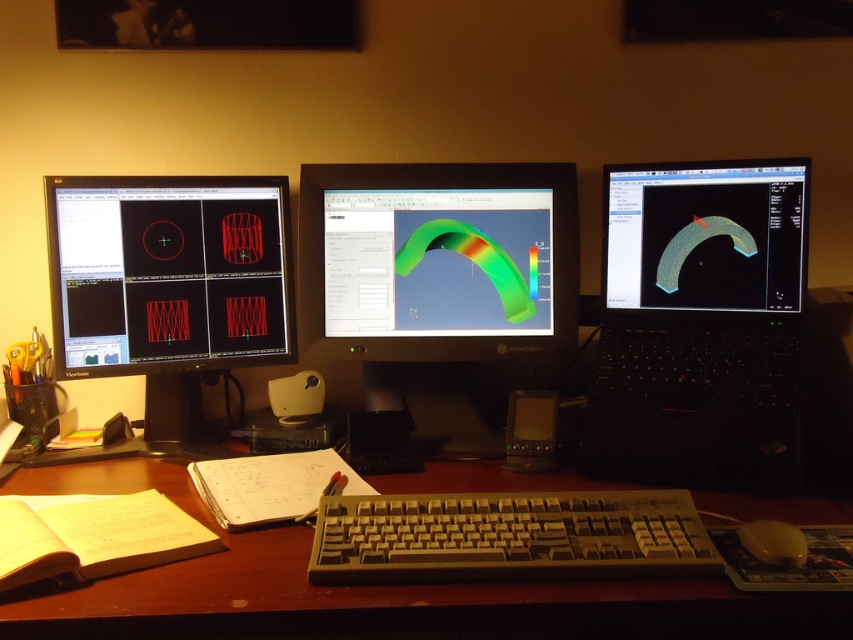
Question: Is green matte 3d model at center thinner than white plastic mouse at lower right?

Choices:
 (A) yes
 (B) no

Answer: (B)

Question: Estimate the real-world distances between objects in this image. Which object is closer to the green matte curved object at center?

Choices:
 (A) brown wood table at center
 (B) green matte monitor at center

Answer: (B)

Question: Can you confirm if black glossy laptop at right is thinner than green matte monitor at center?

Choices:
 (A) yes
 (B) no

Answer: (A)

Question: Considering the real-world distances, which object is closest to the beige plastic keyboard at center?

Choices:
 (A) green matte curved object at center
 (B) brown wood table at center
 (C) green matte 3d model at center

Answer: (B)

Question: Based on their relative distances, which object is nearer to the green matte monitor at center?

Choices:
 (A) black glossy laptop at right
 (B) matte black monitor at left
 (C) beige plastic keyboard at center

Answer: (B)

Question: Can you confirm if green matte 3d model at center is smaller than green matte curved object at center?

Choices:
 (A) yes
 (B) no

Answer: (A)